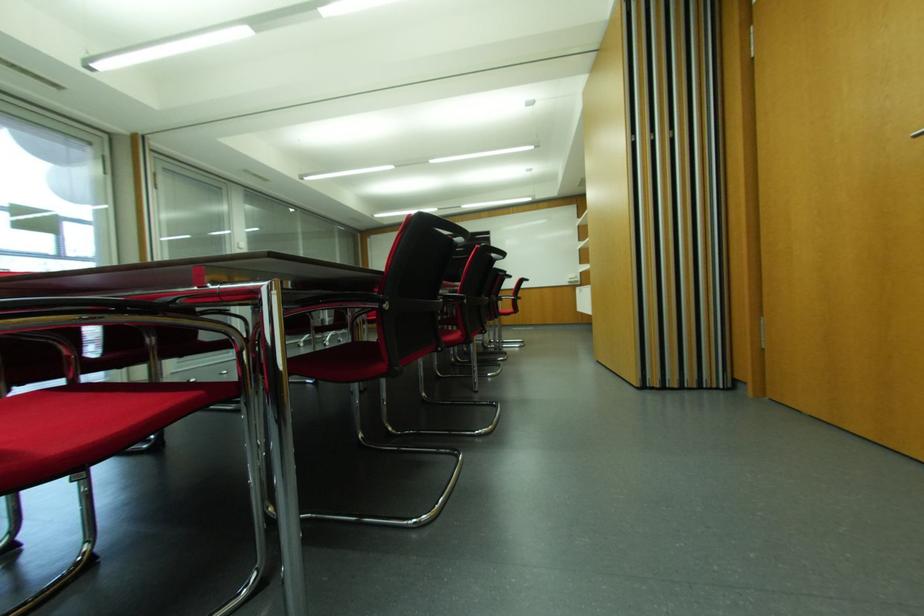
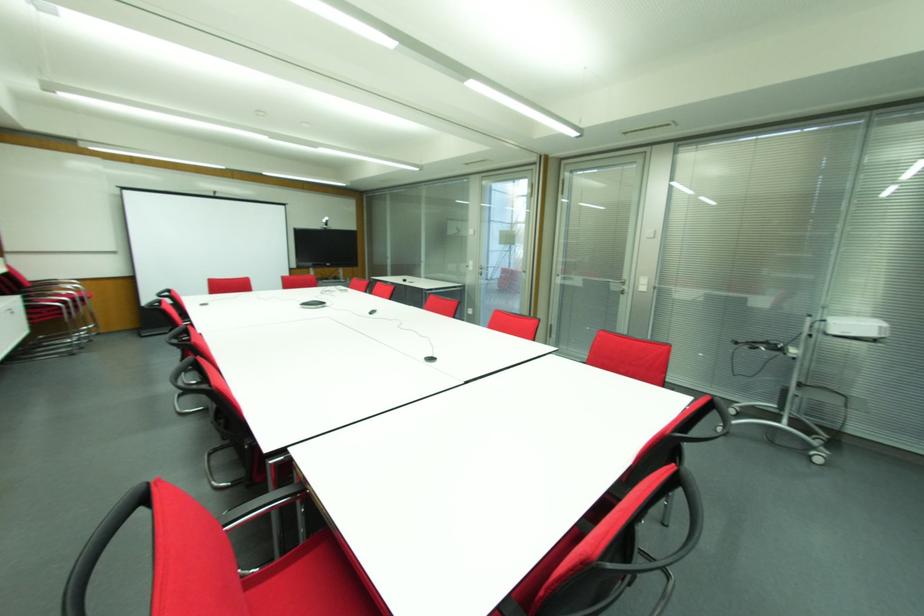
Question: I am providing you with two images of the same scene from different viewpoints. Please identify which objects are invisible in image2.

Choices:
 (A) silver door handle
 (B) black chair armrest
 (C) dark cylindrical pillow
 (D) red chair sitting surface

Answer: (D)